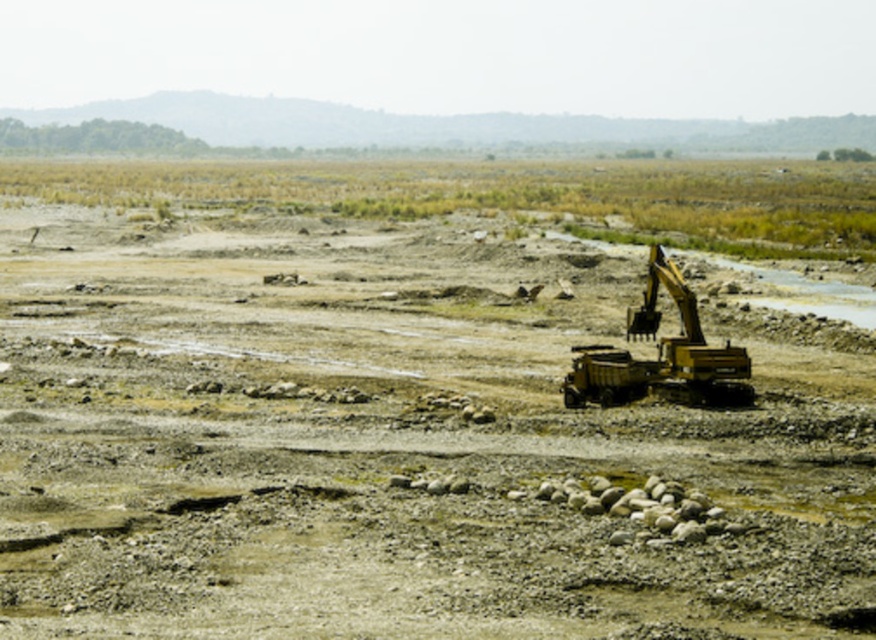
You are standing at the edge of a construction site and want to reach a specific point marked at coordinates point (x=210, y=504). If your maximum walking distance is 50 feet, can you safely reach that point without exceeding your limit?

The distance of point (x=210, y=504) from viewer is 56.18 feet, which exceeds your maximum walking distance of 50 feet. Therefore, you cannot safely reach that point without exceeding your limit.

You are standing at the point with coordinates (394, 445) in the construction site. What object are you standing on?

The point at (394, 445) indicates the yellow metallic excavator at right, so you are standing on the yellow metallic excavator at right.